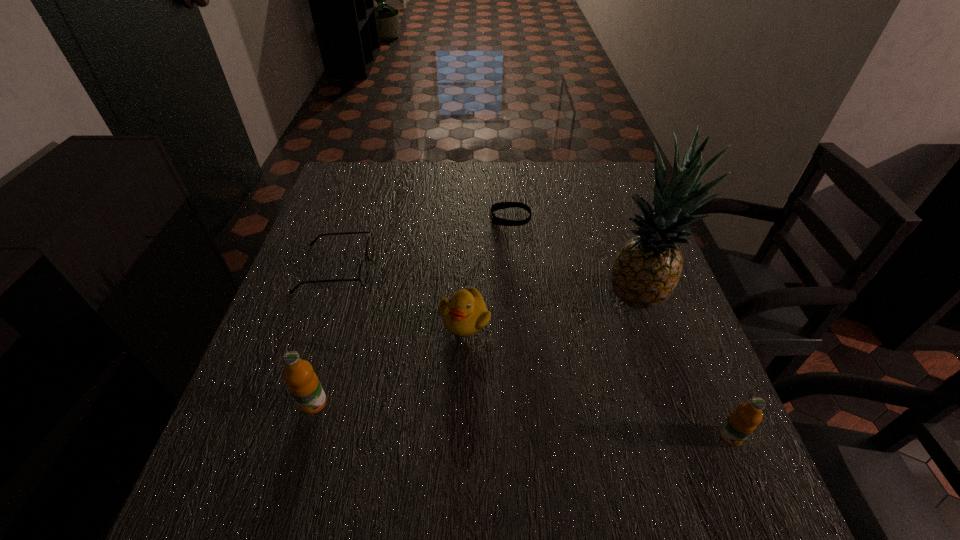
Select which object appears as the fourth closest to the third object from right to left. Please provide its 2D coordinates. Your answer should be formatted as a tuple, i.e. [(x, y)], where the tuple contains the x and y coordinates of a point satisfying the conditions above.

[(303, 383)]

Where is `blank area in the image that satisfies the following two spatial constraints: 1. on the display of the shortest object; 2. on the label of the taller orange juice`? blank area in the image that satisfies the following two spatial constraints: 1. on the display of the shortest object; 2. on the label of the taller orange juice is located at coordinates (525, 403).

Find the location of a particular element. This screenshot has width=960, height=540. free location that satisfies the following two spatial constraints: 1. on the front-facing side of the pineapple; 2. on the right side of the spectacles is located at coordinates click(x=326, y=296).

Where is `vacant region that satisfies the following two spatial constraints: 1. on the display of the wristband; 2. on the label of the fifth farthest object`? Image resolution: width=960 pixels, height=540 pixels. vacant region that satisfies the following two spatial constraints: 1. on the display of the wristband; 2. on the label of the fifth farthest object is located at coordinates (525, 403).

Find the location of a particular element. Image resolution: width=960 pixels, height=540 pixels. vacant point that satisfies the following two spatial constraints: 1. on the display of the shortest object; 2. on the back side of the pineapple is located at coordinates (516, 296).

You are a GUI agent. You are given a task and a screenshot of the screen. Output one action in this format:
    pyautogui.click(x=<x>, y=<y>)
    Task: Click on the free space that satisfies the following two spatial constraints: 1. on the front-facing side of the second shortest object; 2. on the back side of the pineapple
    
    Given the screenshot: What is the action you would take?
    pyautogui.click(x=326, y=296)